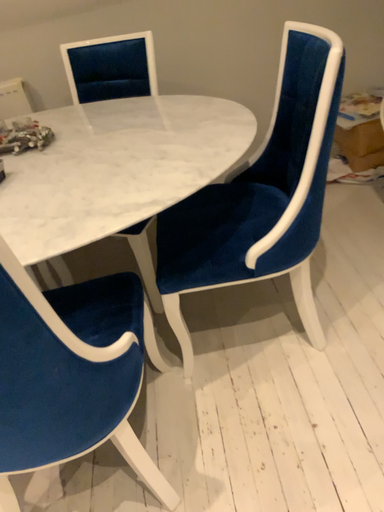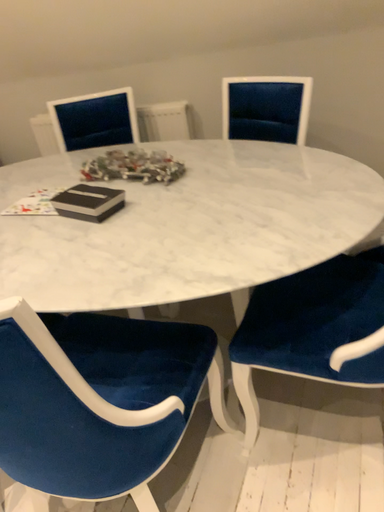
Question: Which way did the camera rotate in the video?

Choices:
 (A) rotated right
 (B) rotated left

Answer: (B)